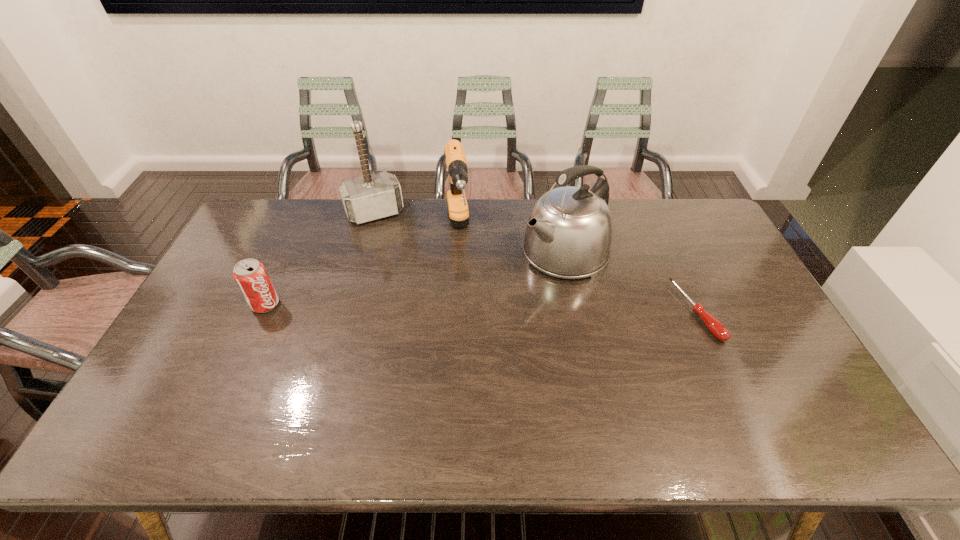
Find the location of a particular element. free space located 0.370m at the tip of the third object from left to right is located at coordinates (472, 359).

At what (x,y) coordinates should I click in order to perform the action: click on vacant space situated 0.290m at the tip of the third object from left to right. Please return your answer as a coordinate pair (x, y). Looking at the image, I should click on (468, 335).

At what (x,y) coordinates should I click in order to perform the action: click on free space located 0.180m at the tip of the third object from left to right. Please return your answer as a coordinate pair (x, y). The image size is (960, 540). Looking at the image, I should click on click(x=464, y=306).

This screenshot has height=540, width=960. Identify the location of free region located 0.160m on the spout of the second object from right to left. (497, 296).

Where is `free space located on the spout of the second object from right to left`? This screenshot has width=960, height=540. free space located on the spout of the second object from right to left is located at coordinates (518, 282).

Where is `free space located on the spout of the second object from right to left`? This screenshot has height=540, width=960. free space located on the spout of the second object from right to left is located at coordinates (495, 298).

At what (x,y) coordinates should I click in order to perform the action: click on vacant space located 0.200m for striking with the head of the fourth object from right to left. Please return your answer as a coordinate pair (x, y). Looking at the image, I should click on (400, 262).

Locate an element on the screen. This screenshot has width=960, height=540. vacant region located for striking with the head of the fourth object from right to left is located at coordinates (393, 247).

You are a GUI agent. You are given a task and a screenshot of the screen. Output one action in this format:
    pyautogui.click(x=<x>, y=<y>)
    Task: Click on the free spot located 0.280m for striking with the head of the fourth object from right to left
    This screenshot has width=960, height=540.
    Given the screenshot: What is the action you would take?
    pyautogui.click(x=408, y=278)

Identify the location of drill at the far edge. This screenshot has width=960, height=540. (455, 158).